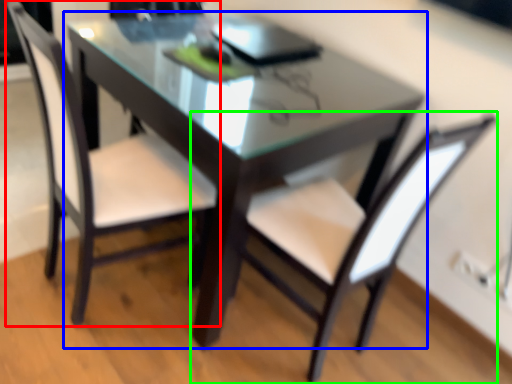
Question: Which object is positioned closest to chair (highlighted by a red box)? Select from table (highlighted by a blue box) and chair (highlighted by a green box).

Choices:
 (A) table
 (B) chair

Answer: (A)